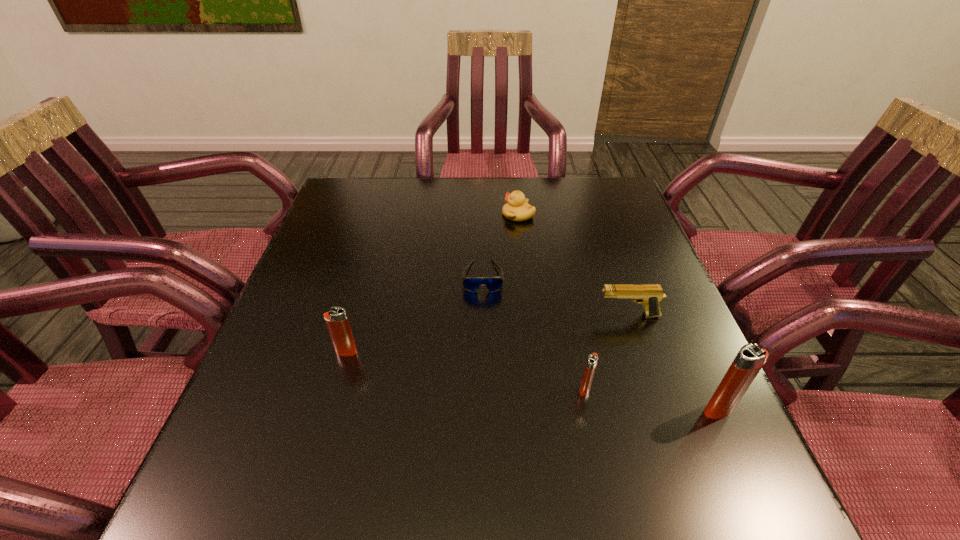
Identify the location of vacant position in the image that satisfies the following two spatial constraints: 1. on the front-facing side of the fifth tallest object; 2. on the front-facing side of the shortest object. (525, 276).

At what (x,y) coordinates should I click in order to perform the action: click on vacant point that satisfies the following two spatial constraints: 1. on the front-facing side of the duckling; 2. on the front-facing side of the sunglasses. Please return your answer as a coordinate pair (x, y). This screenshot has height=540, width=960. Looking at the image, I should click on (525, 276).

Identify the location of free spot that satisfies the following two spatial constraints: 1. at the barrel of the tallest object; 2. on the left side of the third farthest object. (660, 410).

This screenshot has width=960, height=540. Find the location of `vacant region that satisfies the following two spatial constraints: 1. on the back side of the second igniter from left to right; 2. on the front-facing side of the farthest object`. vacant region that satisfies the following two spatial constraints: 1. on the back side of the second igniter from left to right; 2. on the front-facing side of the farthest object is located at coordinates 549,215.

Identify the location of free space that satisfies the following two spatial constraints: 1. on the front-facing side of the tallest igniter; 2. on the right side of the second shortest object. The height and width of the screenshot is (540, 960). (540, 410).

This screenshot has height=540, width=960. I want to click on free region that satisfies the following two spatial constraints: 1. on the front-facing side of the second farthest igniter; 2. on the right side of the shortest object, so [484, 389].

Find the location of `free location that satisfies the following two spatial constraints: 1. on the front-facing side of the second igniter from left to right; 2. on the left side of the second object from left to right`. free location that satisfies the following two spatial constraints: 1. on the front-facing side of the second igniter from left to right; 2. on the left side of the second object from left to right is located at coordinates (484, 389).

Identify the location of free space that satisfies the following two spatial constraints: 1. on the front-facing side of the duckling; 2. on the front-facing side of the sunglasses. The image size is (960, 540). (525, 276).